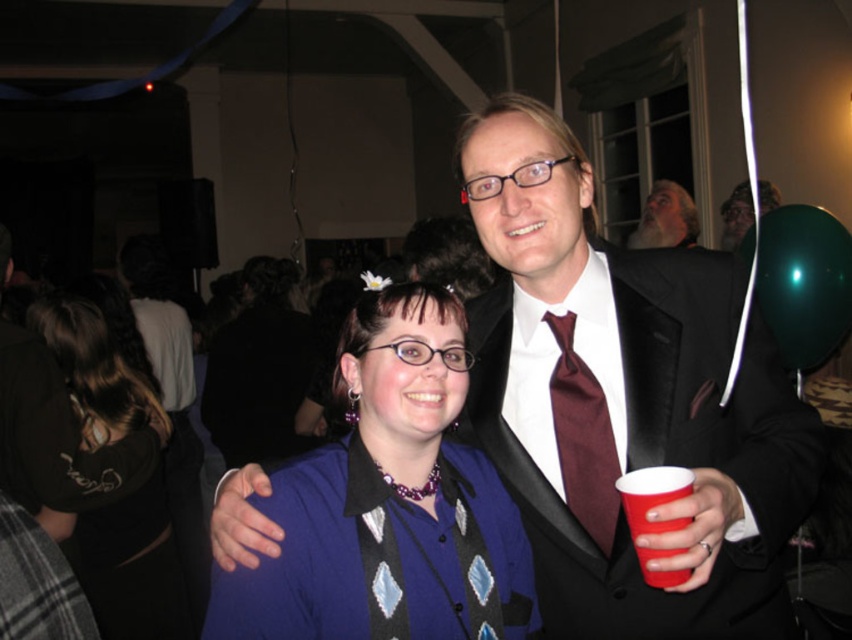
Between point (142, 536) and point (769, 186), which one is positioned behind?

Point (769, 186)

Which is in front, point (64, 344) or point (746, 214)?

Point (64, 344) is more forward.

At what (x,y) coordinates should I click in order to perform the action: click on dark brown leather jacket at lower left. Please return your answer as a coordinate pair (x, y). This screenshot has height=640, width=852. Looking at the image, I should click on (131, 492).

Can you confirm if shiny black suit at center is bigger than burgundy satin tie at right?

Indeed, shiny black suit at center has a larger size compared to burgundy satin tie at right.

Is the position of shiny black suit at center more distant than that of burgundy satin tie at right?

No, it is in front of burgundy satin tie at right.

Locate an element on the screen. The width and height of the screenshot is (852, 640). shiny black suit at center is located at coordinates (625, 401).

Does burgundy satin tie at right have a greater height compared to red plastic cup at right?

Correct, burgundy satin tie at right is much taller as red plastic cup at right.

Is point (580, 440) positioned after point (660, 500)?

Yes, it is behind point (660, 500).

Find the location of a particular element. Image resolution: width=852 pixels, height=640 pixels. burgundy satin tie at right is located at coordinates (583, 436).